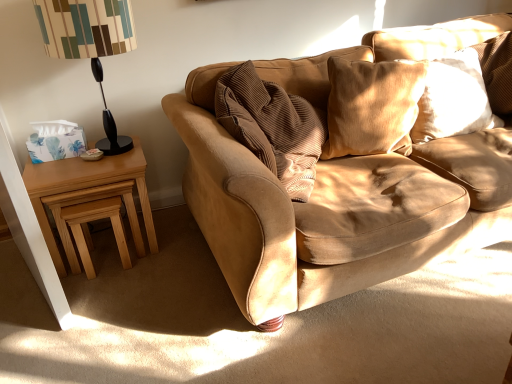
Locate an element on the screen. The height and width of the screenshot is (384, 512). free space in front of light brown wooden stool at lower left is located at coordinates (100, 287).